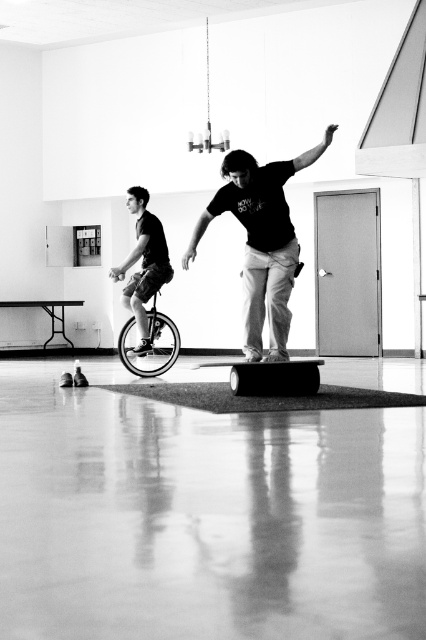
You are a photographer positioned at the entrance of the room. You want to capture a photo of the shiny metallic unicycle at center without including the matte black unicycle at left in the frame. Based on their positions, is this possible?

The matte black unicycle at left is to the left of the shiny metallic unicycle at center, so if you position yourself to the right side of the shiny metallic unicycle at center and aim towards its center, you can exclude the matte black unicycle at left from the frame.

You are a photographer trying to capture a dynamic shot of the scene. You want to ensure that both the matte black unicycle at left and the smooth rubber skateboard at center are clearly visible in the frame. Given their positions, which object should you focus on first to ensure depth of field captures both?

The matte black unicycle at left is above the smooth rubber skateboard at center, so focusing on the matte black unicycle at left first will ensure the depth of field includes both objects since it is closer to the camera.